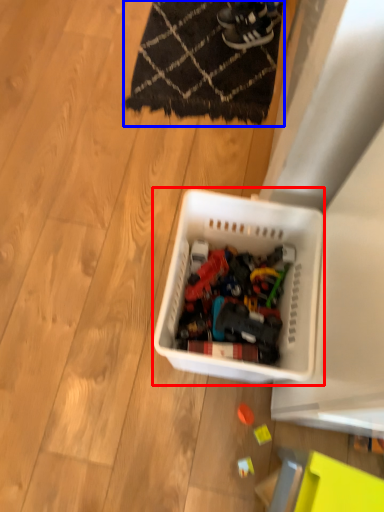
Question: Which of the following is the farthest to the observer, storage box (highlighted by a red box) or mat (highlighted by a blue box)?

Choices:
 (A) storage box
 (B) mat

Answer: (B)